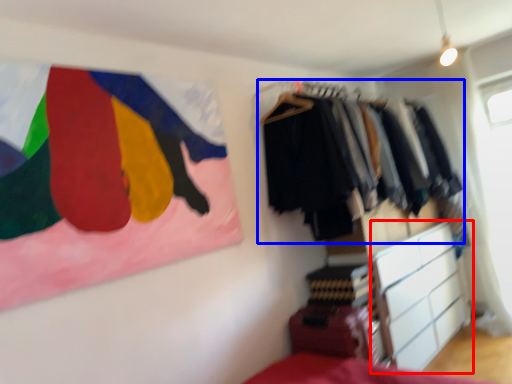
Question: Which object appears farthest to the camera in this image, chest of drawers (highlighted by a red box) or closet (highlighted by a blue box)?

Choices:
 (A) chest of drawers
 (B) closet

Answer: (A)